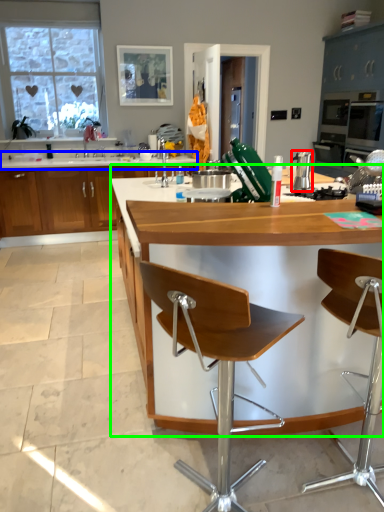
Question: Based on their relative distances, which object is farther from appliance (highlighted by a red box)? Choose from countertop (highlighted by a blue box) and countertop (highlighted by a green box).

Choices:
 (A) countertop
 (B) countertop

Answer: (A)